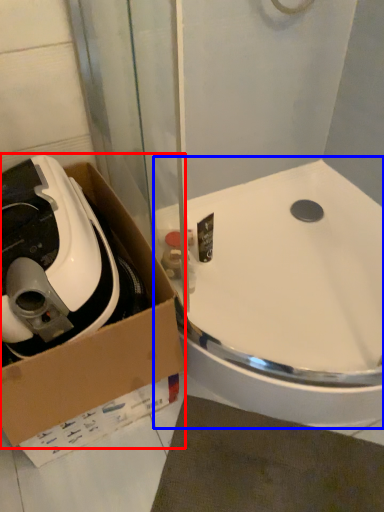
Question: Which of the following is the closest to the observer, box (highlighted by a red box) or sink (highlighted by a blue box)?

Choices:
 (A) box
 (B) sink

Answer: (A)